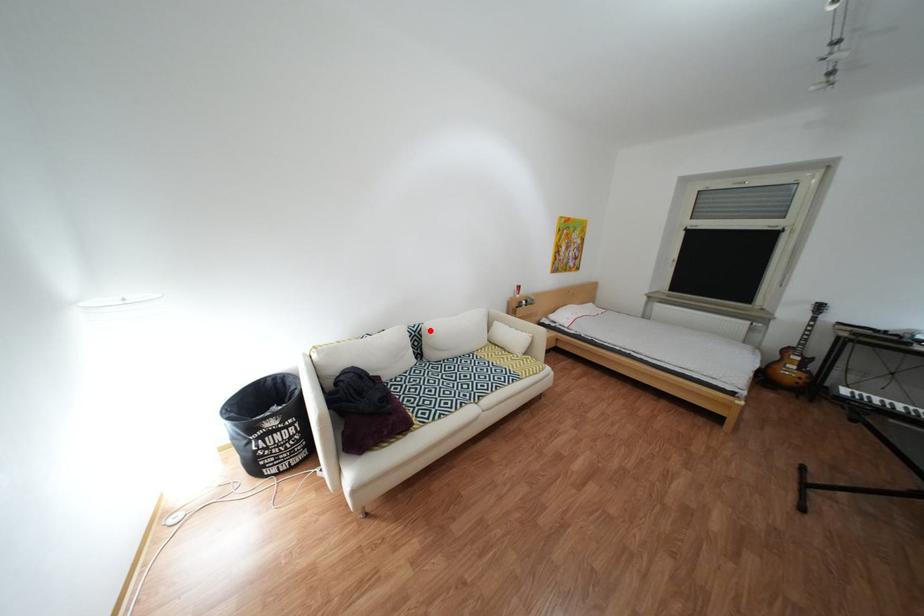
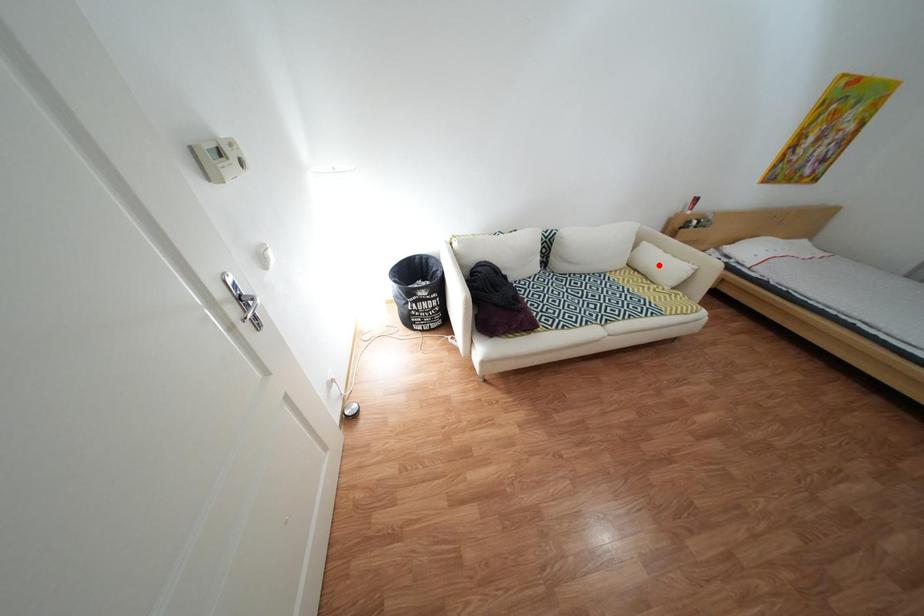
I am providing you with two images of the same scene from different viewpoints. A red point is marked on the first image and another point is marked on the second image. Is the marked point in image1 the same physical position as the marked point in image2?

No